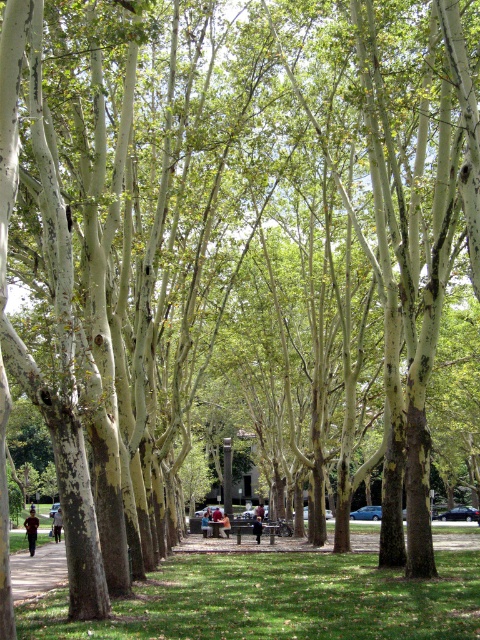
Question: Is light brown leather jacket at center wider than brown leather jacket at center?

Choices:
 (A) yes
 (B) no

Answer: (A)

Question: Which object appears closest to the camera in this image?

Choices:
 (A) light brown leather jacket at center
 (B) dark blue jeans at center

Answer: (A)

Question: Is light brown leather jacket at center positioned behind brown leather jacket at center?

Choices:
 (A) yes
 (B) no

Answer: (B)

Question: Can you confirm if brown leather jacket at center is bigger than dark blue jeans at center?

Choices:
 (A) no
 (B) yes

Answer: (A)

Question: Which object is farther from the camera taking this photo?

Choices:
 (A) brown leather jacket at center
 (B) dark blue jeans at center

Answer: (A)

Question: Which of the following is the farthest from the observer?

Choices:
 (A) light brown leather jacket at center
 (B) dark blue uniform at center
 (C) dark blue jeans at center
 (D) brown leather jacket at center

Answer: (D)